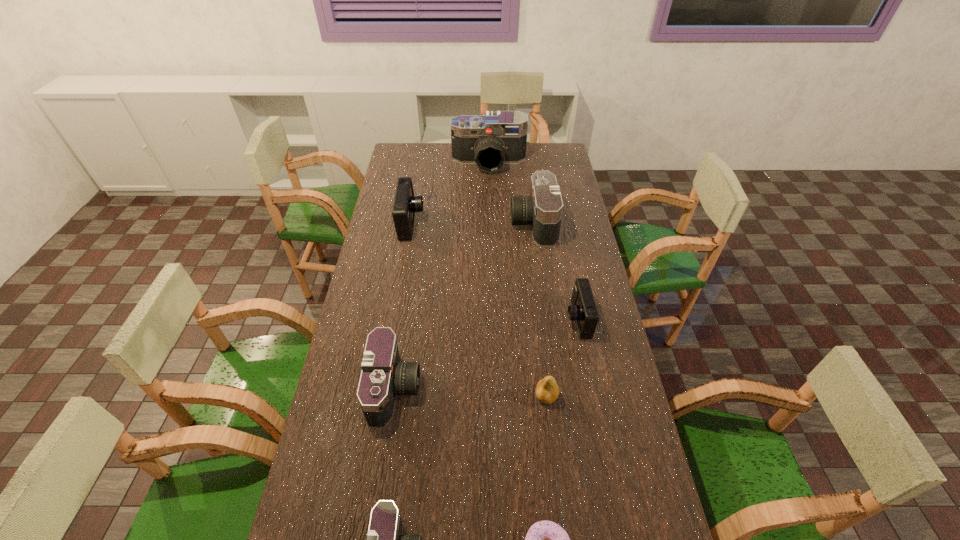
Where is `vacant space positioned on the front-facing side of the tallest camera`? This screenshot has height=540, width=960. vacant space positioned on the front-facing side of the tallest camera is located at coordinates (491, 220).

Identify the location of vacant region located on the front-facing side of the third nearest black camera. (426, 223).

The height and width of the screenshot is (540, 960). I want to click on vacant space located on the front-facing side of the third nearest black camera, so click(426, 223).

Find the location of a particular element. The width and height of the screenshot is (960, 540). blank space located on the front-facing side of the third nearest black camera is located at coordinates (474, 223).

At what (x,y) coordinates should I click in order to perform the action: click on vacant region located on the front-facing side of the farther blue camera. Please return your answer as a coordinate pair (x, y). This screenshot has height=540, width=960. Looking at the image, I should click on (498, 224).

The height and width of the screenshot is (540, 960). Identify the location of vacant space located 0.130m on the front-facing side of the second nearest black camera. (465, 389).

Locate an element on the screen. vacant space located on the right of the pear is located at coordinates (578, 396).

Locate an element on the screen. free region located on the front-facing side of the third nearest camera is located at coordinates pyautogui.click(x=476, y=320).

The height and width of the screenshot is (540, 960). I want to click on free space located on the front-facing side of the third nearest camera, so click(450, 320).

In order to click on vacant point located 0.310m on the front-facing side of the third nearest camera in this screenshot , I will do `click(473, 320)`.